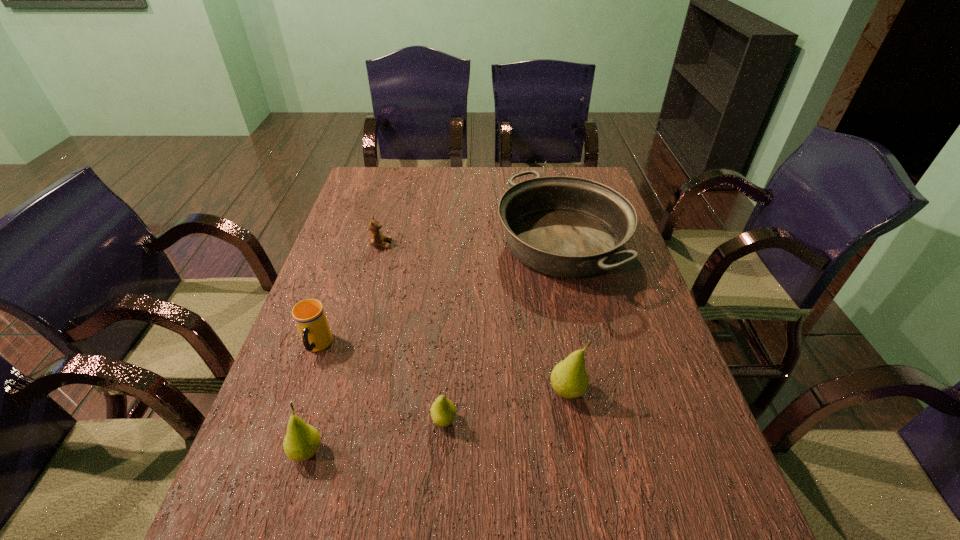
Locate an element on the screen. The height and width of the screenshot is (540, 960). free spot located on the right of the second pear from left to right is located at coordinates (500, 420).

The height and width of the screenshot is (540, 960). Find the location of `vacant area situated on the left of the rightmost pear`. vacant area situated on the left of the rightmost pear is located at coordinates (388, 392).

Identify the location of free space located on the front-facing side of the teddy bear. Image resolution: width=960 pixels, height=540 pixels. (513, 244).

Locate an element on the screen. vacant point located on the back of the pan is located at coordinates (549, 190).

Find the location of a particular element. Image resolution: width=960 pixels, height=540 pixels. vacant point located on the side of the fourth nearest object with the handle is located at coordinates (x=302, y=388).

Locate an element on the screen. The width and height of the screenshot is (960, 540). object that is positioned at the far edge is located at coordinates (562, 226).

Where is `object located in the near edge section of the desktop`? The width and height of the screenshot is (960, 540). object located in the near edge section of the desktop is located at coordinates (301, 442).

Image resolution: width=960 pixels, height=540 pixels. In order to click on pear that is positioned at the left edge in this screenshot , I will do `click(301, 442)`.

Identify the location of teddy bear situated at the left edge. The height and width of the screenshot is (540, 960). (376, 237).

Identify the location of cup located in the left edge section of the desktop. (309, 315).